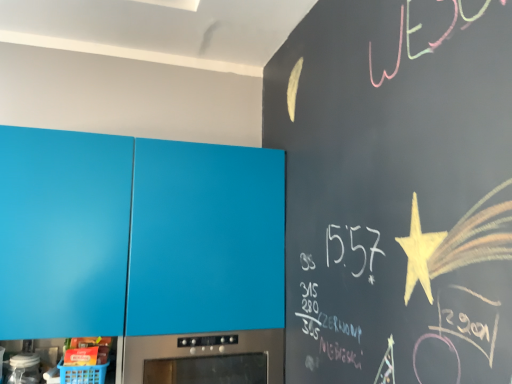
Locate an element on the screen. satin silver oven at lower center is located at coordinates [x=201, y=350].

What do you see at coordinates (201, 350) in the screenshot? I see `satin silver oven at lower center` at bounding box center [201, 350].

Describe the element at coordinates (140, 240) in the screenshot. I see `matte blue cabinet at left` at that location.

Where is `matte blue cabinet at left`? matte blue cabinet at left is located at coordinates coord(140,240).

At what (x,y) coordinates should I click in order to perform the action: click on satin silver oven at lower center. Please return your answer as a coordinate pair (x, y). This screenshot has height=384, width=512. Looking at the image, I should click on (201, 350).

Between satin silver oven at lower center and matte blue cabinet at left, which one appears on the left side from the viewer's perspective?

matte blue cabinet at left is more to the left.

Is satin silver oven at lower center further to camera compared to matte blue cabinet at left?

Yes, it is behind matte blue cabinet at left.

Which is nearer, (137, 378) or (283, 289)?

Clearly, point (137, 378) is closer to the camera than point (283, 289).

From the image's perspective, is satin silver oven at lower center above matte blue cabinet at left?

Incorrect, from the image's perspective, satin silver oven at lower center is lower than matte blue cabinet at left.

From a real-world perspective, is satin silver oven at lower center beneath matte blue cabinet at left?

Yes, from a real-world perspective, satin silver oven at lower center is beneath matte blue cabinet at left.

Between satin silver oven at lower center and matte blue cabinet at left, which one has smaller width?

matte blue cabinet at left.

Is satin silver oven at lower center taller or shorter than matte blue cabinet at left?

In the image, satin silver oven at lower center appears to be shorter than matte blue cabinet at left.

In the scene shown: Considering the relative sizes of satin silver oven at lower center and matte blue cabinet at left in the image provided, is satin silver oven at lower center smaller than matte blue cabinet at left?

Correct, satin silver oven at lower center occupies less space than matte blue cabinet at left.

Which is correct: satin silver oven at lower center is inside matte blue cabinet at left, or outside of it?

satin silver oven at lower center fits inside matte blue cabinet at left.

Does satin silver oven at lower center touch matte blue cabinet at left?

satin silver oven at lower center and matte blue cabinet at left are clearly separated.

Is satin silver oven at lower center oriented towards matte blue cabinet at left?

Yes, satin silver oven at lower center is turned towards matte blue cabinet at left.

What's the angular difference between satin silver oven at lower center and matte blue cabinet at left's facing directions?

They differ by 0.00028 degrees in their facing directions.

At what (x,y) coordinates should I click in order to perform the action: click on cabinetry lying in front of the satin silver oven at lower center. Please return your answer as a coordinate pair (x, y). Looking at the image, I should click on (140, 240).

Based on their positions, is matte blue cabinet at left located to the left or right of satin silver oven at lower center?

Based on their positions, matte blue cabinet at left is located to the left of satin silver oven at lower center.

Is matte blue cabinet at left positioned in front of satin silver oven at lower center?

Yes, matte blue cabinet at left is in front of satin silver oven at lower center.

Is point (222, 218) less distant than point (283, 331)?

Yes, point (222, 218) is closer to viewer.

Consider the image. From the image's perspective, is matte blue cabinet at left on satin silver oven at lower center?

Yes, from the image's perspective, matte blue cabinet at left is over satin silver oven at lower center.

From a real-world perspective, who is located lower, matte blue cabinet at left or satin silver oven at lower center?

satin silver oven at lower center is physically lower.

Considering the relative sizes of matte blue cabinet at left and satin silver oven at lower center in the image provided, is matte blue cabinet at left thinner than satin silver oven at lower center?

Correct, the width of matte blue cabinet at left is less than that of satin silver oven at lower center.

In terms of height, does matte blue cabinet at left look taller or shorter compared to satin silver oven at lower center?

Clearly, matte blue cabinet at left is taller compared to satin silver oven at lower center.

Is matte blue cabinet at left bigger or smaller than satin silver oven at lower center?

Clearly, matte blue cabinet at left is larger in size than satin silver oven at lower center.

In the scene shown: Is matte blue cabinet at left inside or outside of satin silver oven at lower center?

matte blue cabinet at left is outside satin silver oven at lower center.

Is matte blue cabinet at left next to satin silver oven at lower center and touching it?

There is a gap between matte blue cabinet at left and satin silver oven at lower center.

Does matte blue cabinet at left turn towards satin silver oven at lower center?

Yes, matte blue cabinet at left faces towards satin silver oven at lower center.

Where is `home appliance below the matte blue cabinet at left (from a real-world perspective)`? home appliance below the matte blue cabinet at left (from a real-world perspective) is located at coordinates (201, 350).

At what (x,y) coordinates should I click in order to perform the action: click on home appliance on the right side of matte blue cabinet at left. Please return your answer as a coordinate pair (x, y). Image resolution: width=512 pixels, height=384 pixels. Looking at the image, I should click on 201,350.

This screenshot has height=384, width=512. I want to click on cabinetry above the satin silver oven at lower center (from a real-world perspective), so click(x=140, y=240).